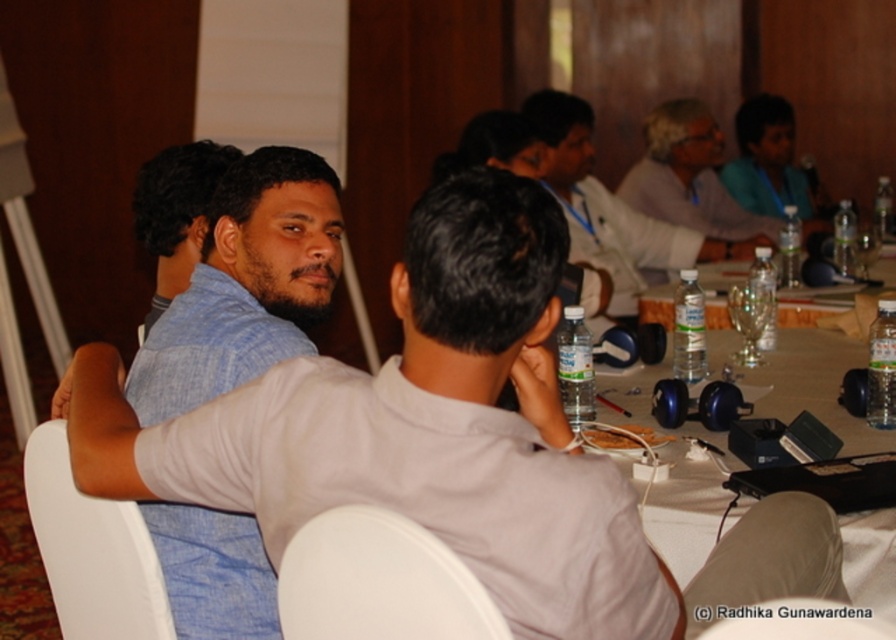
Question: Which object is positioned closest to the light beige shirt at center?

Choices:
 (A) white plastic table at center
 (B) blue denim shirt at left

Answer: (A)

Question: Can you confirm if white plastic table at center is smaller than light beige shirt at center?

Choices:
 (A) yes
 (B) no

Answer: (A)

Question: Among these objects, which one is farthest from the camera?

Choices:
 (A) light beige shirt at center
 (B) white plastic table at center

Answer: (A)

Question: Can you confirm if blue denim shirt at left is positioned to the right of light blue shirt at upper right?

Choices:
 (A) yes
 (B) no

Answer: (B)

Question: Which point is farther from the camera taking this photo?

Choices:
 (A) (270, 184)
 (B) (673, 131)

Answer: (B)

Question: Is blue denim shirt at left to the left of light beige shirt at center from the viewer's perspective?

Choices:
 (A) yes
 (B) no

Answer: (A)